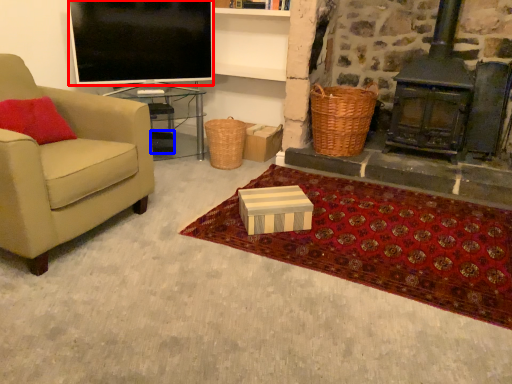
Question: Which of the following is the farthest to the observer, television (highlighted by a red box) or box (highlighted by a blue box)?

Choices:
 (A) television
 (B) box

Answer: (B)